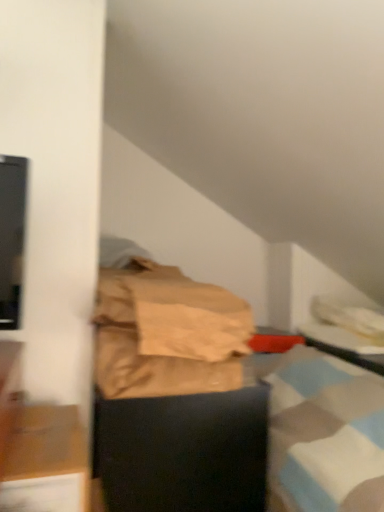
Where is `empty space that is ontop of wooden cabinet at lower left, which appears as the first furniture when viewed from the front`? The width and height of the screenshot is (384, 512). empty space that is ontop of wooden cabinet at lower left, which appears as the first furniture when viewed from the front is located at coordinates (59, 431).